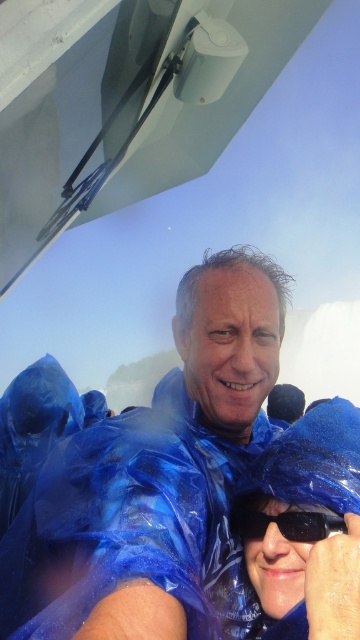
Can you confirm if blue plastic poncho at center is wider than black plastic goggles at center?

Indeed, blue plastic poncho at center has a greater width compared to black plastic goggles at center.

Is blue plastic poncho at center shorter than black plastic goggles at center?

No.

Identify the location of blue plastic poncho at center. The height and width of the screenshot is (640, 360). (146, 476).